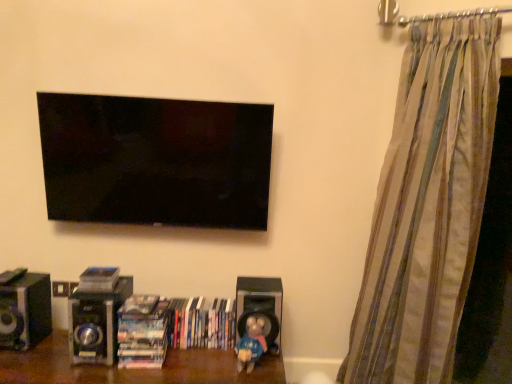
Question: Should I look upward or downward to see striped fabric curtain at right?

Choices:
 (A) down
 (B) up

Answer: (A)

Question: Is wooden shelf at lower center positioned far away from blue matte toy at lower center?

Choices:
 (A) yes
 (B) no

Answer: (B)

Question: From the image's perspective, is wooden shelf at lower center located beneath blue matte toy at lower center?

Choices:
 (A) yes
 (B) no

Answer: (A)

Question: Could you tell me if wooden shelf at lower center is turned towards blue matte toy at lower center?

Choices:
 (A) yes
 (B) no

Answer: (B)

Question: Does wooden shelf at lower center have a lesser height compared to blue matte toy at lower center?

Choices:
 (A) no
 (B) yes

Answer: (A)

Question: Considering the relative sizes of wooden shelf at lower center and blue matte toy at lower center in the image provided, is wooden shelf at lower center bigger than blue matte toy at lower center?

Choices:
 (A) yes
 (B) no

Answer: (A)

Question: Is the depth of wooden shelf at lower center greater than that of blue matte toy at lower center?

Choices:
 (A) no
 (B) yes

Answer: (A)

Question: Is wooden shelf at lower center shorter than black matte speaker at lower center, the 3th speaker when ordered from left to right?

Choices:
 (A) yes
 (B) no

Answer: (B)

Question: From the image's perspective, is wooden shelf at lower center on black matte speaker at lower center, the 3th speaker when ordered from left to right?

Choices:
 (A) no
 (B) yes

Answer: (A)

Question: From a real-world perspective, is wooden shelf at lower center physically below black matte speaker at lower center, which is the 1th speaker in right-to-left order?

Choices:
 (A) yes
 (B) no

Answer: (A)

Question: Would you consider wooden shelf at lower center to be distant from black matte speaker at lower center, the 3th speaker when ordered from left to right?

Choices:
 (A) no
 (B) yes

Answer: (A)

Question: Is wooden shelf at lower center further to camera compared to black matte speaker at lower center, which is the 1th speaker in right-to-left order?

Choices:
 (A) yes
 (B) no

Answer: (B)

Question: Is wooden shelf at lower center smaller than black matte speaker at lower center, the 3th speaker when ordered from left to right?

Choices:
 (A) no
 (B) yes

Answer: (A)

Question: From a real-world perspective, is matte plastic book at lower center, which is the 1th book in left-to-right order, physically above black glossy speaker at lower left, the third speaker viewed from the right?

Choices:
 (A) no
 (B) yes

Answer: (B)